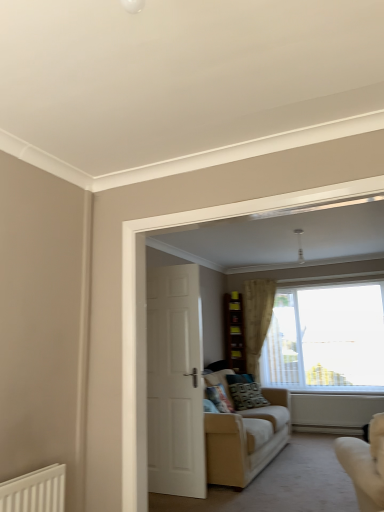
This screenshot has width=384, height=512. What do you see at coordinates (257, 318) in the screenshot?
I see `sheer beige curtain at center` at bounding box center [257, 318].

What do you see at coordinates (326, 339) in the screenshot? I see `transparent glass window at center` at bounding box center [326, 339].

Image resolution: width=384 pixels, height=512 pixels. In order to click on beige fabric couch at center, acting as the 2th studio couch starting from the front in this screenshot , I will do `click(246, 439)`.

Is transparent glass window at center taller than patterned fabric pillow at center, which appears as the second pillow when viewed from the back?

Yes.

Looking at this image, considering the relative sizes of transparent glass window at center and patterned fabric pillow at center, which appears as the second pillow when viewed from the back, in the image provided, is transparent glass window at center wider than patterned fabric pillow at center, which appears as the second pillow when viewed from the back,?

In fact, transparent glass window at center might be narrower than patterned fabric pillow at center, which appears as the second pillow when viewed from the back.

From a real-world perspective, is transparent glass window at center physically located above or below patterned fabric pillow at center, which appears as the second pillow when viewed from the back?

transparent glass window at center is situated higher than patterned fabric pillow at center, which appears as the second pillow when viewed from the back, in the real world.

Is beige fabric couch at lower right, marked as the 1th studio couch in a front-to-back arrangement, facing away from sheer beige curtain at center?

beige fabric couch at lower right, marked as the 1th studio couch in a front-to-back arrangement, does not have its back to sheer beige curtain at center.

Does beige fabric couch at lower right, marked as the 1th studio couch in a front-to-back arrangement, contain sheer beige curtain at center?

No, sheer beige curtain at center is not surrounded by beige fabric couch at lower right, marked as the 1th studio couch in a front-to-back arrangement.

The height and width of the screenshot is (512, 384). Identify the location of the 2nd studio couch in front of the sheer beige curtain at center, starting your count from the anchor. (365, 464).

Can you confirm if beige fabric couch at lower right, marked as the 1th studio couch in a front-to-back arrangement, is smaller than sheer beige curtain at center?

No.

Is patterned fabric pillow at center, the first pillow when ordered from back to front, not close to transparent glass window at center?

That's right, there is a large distance between patterned fabric pillow at center, the first pillow when ordered from back to front, and transparent glass window at center.

Which is less distant, [242,409] or [295,333]?

The point [242,409] is closer to the camera.

Is patterned fabric pillow at center, the first pillow when ordered from back to front, oriented towards transparent glass window at center?

No, patterned fabric pillow at center, the first pillow when ordered from back to front, is not aimed at transparent glass window at center.

Could you measure the distance between brown wooden bookshelf at center and patterned fabric pillow at center, the 1th pillow from the right?

38.44 inches.

I want to click on cabinetry above the patterned fabric pillow at center, the 1th pillow from the right (from the image's perspective), so click(234, 333).

From a real-world perspective, which object stands above the other?

brown wooden bookshelf at center, from a real-world perspective.

Does point (241, 367) come farther from viewer compared to point (267, 400)?

Yes, it is.

From a real-world perspective, who is located lower, beige fabric couch at center, which is the first studio couch in back-to-front order, or beige fabric couch at lower right, which is the 2th studio couch from back to front?

From a 3D spatial view, beige fabric couch at center, which is the first studio couch in back-to-front order, is below.

Does beige fabric couch at center, acting as the 2th studio couch starting from the front, have a lesser height compared to beige fabric couch at lower right, marked as the 1th studio couch in a front-to-back arrangement?

No.

From the picture: Can you tell me how much beige fabric couch at center, which is the first studio couch in back-to-front order, and beige fabric couch at lower right, which is the 2th studio couch from back to front, differ in facing direction?

They differ by 112 degrees in their facing directions.

In the image, is beige fabric couch at center, which is the first studio couch in back-to-front order, positioned in front of or behind beige fabric couch at lower right, which is the 2th studio couch from back to front?

Clearly, beige fabric couch at center, which is the first studio couch in back-to-front order, is behind beige fabric couch at lower right, which is the 2th studio couch from back to front.

Do you think brown wooden bookshelf at center is within sheer beige curtain at center, or outside of it?

brown wooden bookshelf at center is not enclosed by sheer beige curtain at center.

Who is shorter, brown wooden bookshelf at center or sheer beige curtain at center?

Standing shorter between the two is brown wooden bookshelf at center.

Looking at this image, is brown wooden bookshelf at center far from sheer beige curtain at center?

No, brown wooden bookshelf at center is not far from sheer beige curtain at center.

Based on their sizes in the image, would you say brown wooden bookshelf at center is bigger or smaller than sheer beige curtain at center?

brown wooden bookshelf at center is smaller than sheer beige curtain at center.

Could you tell me if beige fabric couch at lower right, which is the 2th studio couch from back to front, is turned towards transparent glass window at center?

Yes, beige fabric couch at lower right, which is the 2th studio couch from back to front, is oriented towards transparent glass window at center.

Is beige fabric couch at lower right, marked as the 1th studio couch in a front-to-back arrangement, spatially inside transparent glass window at center, or outside of it?

beige fabric couch at lower right, marked as the 1th studio couch in a front-to-back arrangement, is outside transparent glass window at center.

Identify the location of window that appears above the patterned fabric pillow at center, marked as the first pillow in a front-to-back arrangement (from a real-world perspective). This screenshot has width=384, height=512. (326, 339).

Locate an element on the screen. This screenshot has width=384, height=512. curtain lying behind the beige fabric couch at lower right, marked as the 1th studio couch in a front-to-back arrangement is located at coordinates (257, 318).

When comparing their distances from sheer beige curtain at center, does patterned fabric pillow at center, the first pillow when ordered from back to front, or patterned fabric pillow at center, marked as the first pillow in a front-to-back arrangement, seem further?

Among the two, patterned fabric pillow at center, marked as the first pillow in a front-to-back arrangement, is located further to sheer beige curtain at center.

Which object lies nearer to the anchor point patterned fabric pillow at center, the 1th pillow from the right, white glossy door at center or brown wooden bookshelf at center?

brown wooden bookshelf at center is closer to patterned fabric pillow at center, the 1th pillow from the right.

Considering their positions, is transparent glass window at center positioned closer to sheer beige curtain at center than beige fabric couch at lower right, which is the 2th studio couch from back to front?

transparent glass window at center is closer to sheer beige curtain at center.

Which object lies further to the anchor point beige fabric couch at lower right, marked as the 1th studio couch in a front-to-back arrangement, brown wooden bookshelf at center or transparent glass window at center?

brown wooden bookshelf at center is positioned further to the anchor beige fabric couch at lower right, marked as the 1th studio couch in a front-to-back arrangement.

Estimate the real-world distances between objects in this image. Which object is closer to white glossy door at center, patterned fabric pillow at center, which is the second pillow in left-to-right order, or patterned fabric pillow at center, positioned as the 2th pillow in right-to-left order?

patterned fabric pillow at center, positioned as the 2th pillow in right-to-left order, is positioned closer to the anchor white glossy door at center.

Looking at the image, which one is located closer to sheer beige curtain at center, patterned fabric pillow at center, which ranks as the second pillow in front-to-back order, or transparent glass window at center?

transparent glass window at center is closer to sheer beige curtain at center.

Considering their positions, is beige fabric couch at lower right, marked as the 1th studio couch in a front-to-back arrangement, positioned closer to white glossy door at center than patterned fabric pillow at center, which is the second pillow in left-to-right order?

beige fabric couch at lower right, marked as the 1th studio couch in a front-to-back arrangement, lies closer to white glossy door at center than the other object.

When comparing their distances from patterned fabric pillow at center, which appears as the first pillow when viewed from the left, does patterned fabric pillow at center, the first pillow when ordered from back to front, or white glossy door at center seem further?

white glossy door at center lies further to patterned fabric pillow at center, which appears as the first pillow when viewed from the left, than the other object.

I want to click on curtain situated between patterned fabric pillow at center, positioned as the 2th pillow in right-to-left order, and transparent glass window at center from left to right, so (257, 318).

I want to click on door between beige fabric couch at center, which is the first studio couch in back-to-front order, and brown wooden bookshelf at center in the front-back direction, so click(x=175, y=382).

At what (x,y) coordinates should I click in order to perform the action: click on pillow positioned between beige fabric couch at lower right, marked as the 1th studio couch in a front-to-back arrangement, and patterned fabric pillow at center, the 1th pillow from the right, from near to far. Please return your answer as a coordinate pair (x, y). Looking at the image, I should click on pyautogui.click(x=219, y=398).

Find the location of a particular element. This screenshot has height=512, width=384. curtain between brown wooden bookshelf at center and transparent glass window at center from left to right is located at coordinates (257, 318).